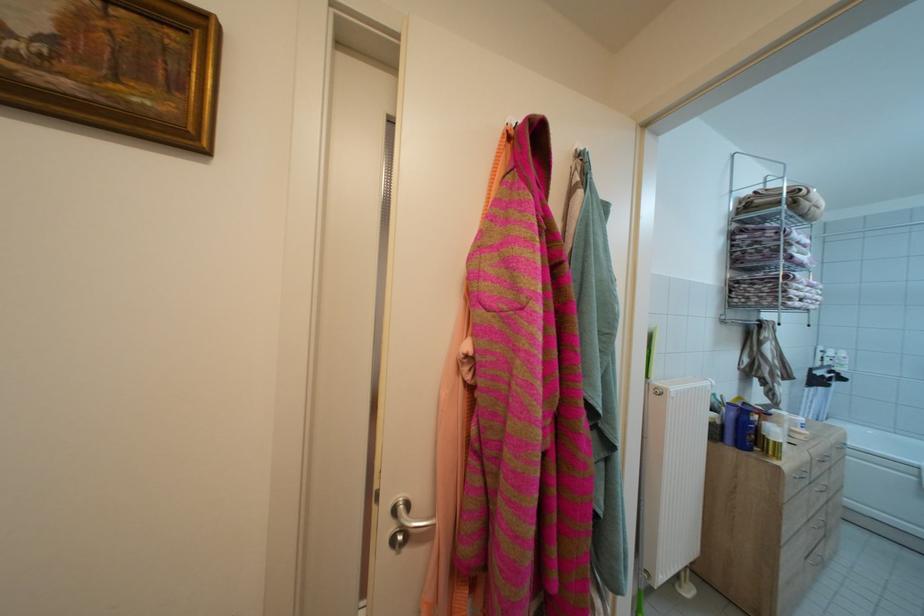
Where would you lift the purple plastic bottle? Please return your answer as a coordinate pair (x, y).

(746, 428)